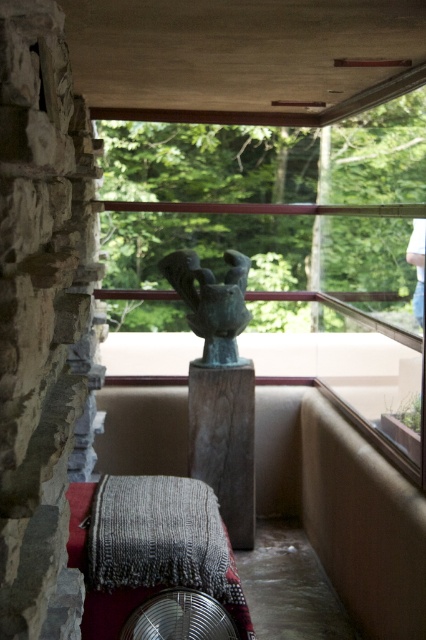
Question: Is wooden pole at center positioned at the back of bronze statue at center?

Choices:
 (A) yes
 (B) no

Answer: (A)

Question: Which of the following is the farthest from the observer?

Choices:
 (A) bronze statue at center
 (B) green patina metal sculpture at center
 (C) metallic silver fan at lower center

Answer: (A)

Question: Which point is closer to the camera?

Choices:
 (A) (189, 269)
 (B) (230, 371)
 (C) (408, 292)
 (D) (164, 632)

Answer: (D)

Question: Which object is closer to the camera taking this photo?

Choices:
 (A) metallic silver fan at lower center
 (B) green patina metal sculpture at center
 (C) wooden pole at center
 (D) bronze statue at center

Answer: (A)

Question: Can you confirm if green patina metal sculpture at center is bigger than metallic silver fan at lower center?

Choices:
 (A) no
 (B) yes

Answer: (B)

Question: Is green patina metal sculpture at center thinner than wooden pole at center?

Choices:
 (A) yes
 (B) no

Answer: (B)